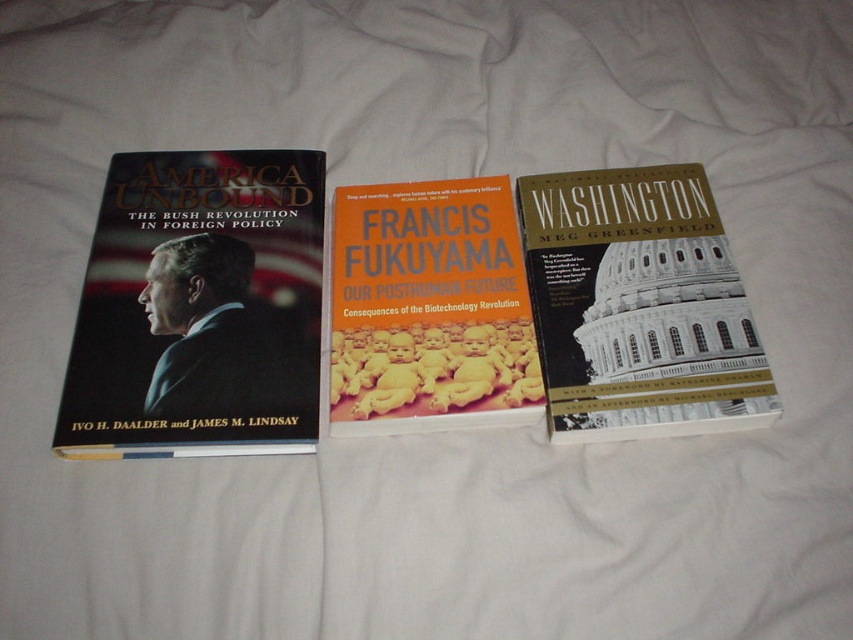
You are organizing a bookshelf and need to place both the hardcover book at center and the orange matte book at center. Based on their positions in the image, which book should you place on the left side of the shelf?

The orange matte book at center should be placed on the left side of the shelf since it is positioned to the left of the hardcover book at center in the image.

You are organizing a bookshelf and have two books to place side by side. The hardcover book at left has a width of 15 cm, and the orange matte book at center is 10 cm wide. If the shelf space available is 25 cm, can both books fit side by side without overlapping?

The hardcover book at left is bigger than the orange matte book at center. The combined width of both books is 25 cm, which exactly matches the available shelf space of 25 cm. Therefore, both books can fit side by side without overlapping.